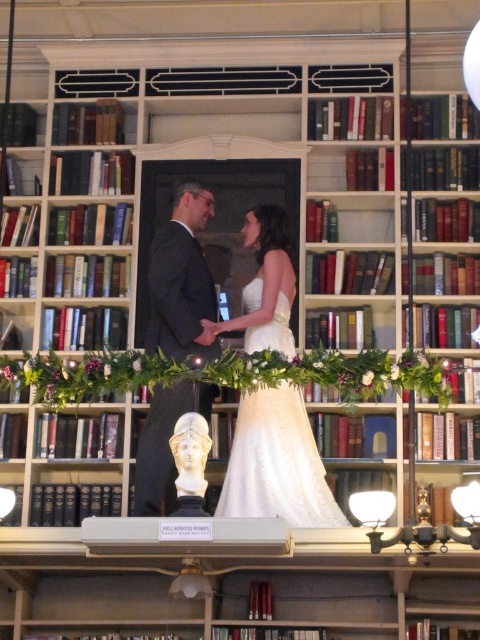
You are a photographer at the wedding and need to ensure both the white satin dress at center and the matte black suit at center are clearly visible in the photo. Given their sizes, which one might require more careful framing to avoid being overshadowed?

The white satin dress at center has a larger size compared to the matte black suit at center, so the photographer should ensure the matte black suit at center is framed in a way that it isn not overshadowed by the larger dress.